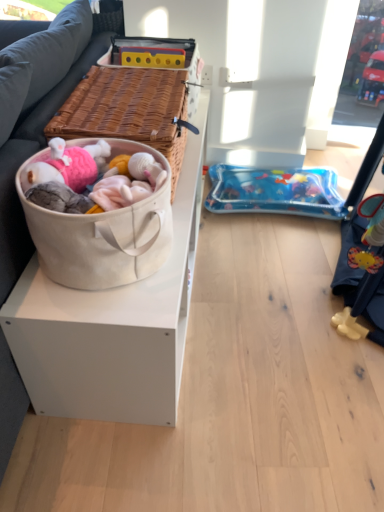
Identify the location of blue inflatable mattress at lower right. Image resolution: width=384 pixels, height=512 pixels. (275, 191).

Describe the element at coordinates (41, 146) in the screenshot. I see `dark gray fabric couch at left` at that location.

Measure the distance between beige canvas basket at left and camera.

A distance of 34.04 inches exists between beige canvas basket at left and camera.

Identify the location of woven brown picnic basket at left. The width and height of the screenshot is (384, 512). (129, 110).

Image resolution: width=384 pixels, height=512 pixels. In order to click on picnic basket above the beige canvas basket at left (from the image's perspective) in this screenshot , I will do `click(129, 110)`.

Considering the relative positions of woven brown picnic basket at left and beige canvas basket at left in the image provided, is woven brown picnic basket at left to the right of beige canvas basket at left from the viewer's perspective?

Yes.

Does woven brown picnic basket at left turn towards beige canvas basket at left?

No, woven brown picnic basket at left is not turned towards beige canvas basket at left.

Which is behind, woven brown picnic basket at left or beige canvas basket at left?

woven brown picnic basket at left is further from the camera.

Is blue inflatable mattress at lower right in front of or behind woven brown picnic basket at left in the image?

Visually, blue inflatable mattress at lower right is located behind woven brown picnic basket at left.

From the image's perspective, is blue inflatable mattress at lower right located above woven brown picnic basket at left?

No, from the image's perspective, blue inflatable mattress at lower right is not on top of woven brown picnic basket at left.

Is blue inflatable mattress at lower right outside of woven brown picnic basket at left?

blue inflatable mattress at lower right lies outside woven brown picnic basket at left's area.

Is point (258, 197) positioned behind point (85, 97)?

Yes, it is behind point (85, 97).

Considering the positions of point (56, 99) and point (54, 245), is point (56, 99) closer or farther from the camera than point (54, 245)?

Point (56, 99) appears to be farther away from the viewer than point (54, 245).

Considering the sizes of dark gray fabric couch at left and beige canvas basket at left in the image, is dark gray fabric couch at left taller or shorter than beige canvas basket at left?

In the image, dark gray fabric couch at left appears to be taller than beige canvas basket at left.

Is dark gray fabric couch at left beside beige canvas basket at left?

dark gray fabric couch at left is not next to beige canvas basket at left, and they're not touching.

Can we say dark gray fabric couch at left lies outside beige canvas basket at left?

Absolutely, dark gray fabric couch at left is external to beige canvas basket at left.

Looking at this image, from the image's perspective, is beige canvas basket at left under woven brown picnic basket at left?

Indeed, from the image's perspective, beige canvas basket at left is shown beneath woven brown picnic basket at left.

Considering the relative positions of beige canvas basket at left and woven brown picnic basket at left in the image provided, is beige canvas basket at left to the left or to the right of woven brown picnic basket at left?

beige canvas basket at left is positioned on woven brown picnic basket at left's left side.

Consider the image. Which object is closer to the camera, beige canvas basket at left or woven brown picnic basket at left?

beige canvas basket at left.

Which of these two, beige canvas basket at left or woven brown picnic basket at left, stands shorter?

Standing shorter between the two is woven brown picnic basket at left.

Would you consider beige canvas basket at left to be distant from dark gray fabric couch at left?

No, beige canvas basket at left is in close proximity to dark gray fabric couch at left.

Would you say beige canvas basket at left is outside dark gray fabric couch at left?

Yes, beige canvas basket at left is located beyond the bounds of dark gray fabric couch at left.

From the image's perspective, is beige canvas basket at left under dark gray fabric couch at left?

Yes, from the image's perspective, beige canvas basket at left is below dark gray fabric couch at left.

Looking at the image, does beige canvas basket at left seem bigger or smaller compared to dark gray fabric couch at left?

beige canvas basket at left is smaller than dark gray fabric couch at left.

Does blue inflatable mattress at lower right turn towards beige canvas basket at left?

No.

Based on their sizes in the image, would you say blue inflatable mattress at lower right is bigger or smaller than beige canvas basket at left?

blue inflatable mattress at lower right is smaller than beige canvas basket at left.

Considering the positions of objects blue inflatable mattress at lower right and beige canvas basket at left in the image provided, who is more to the right, blue inflatable mattress at lower right or beige canvas basket at left?

From the viewer's perspective, blue inflatable mattress at lower right appears more on the right side.

Is blue inflatable mattress at lower right taller or shorter than beige canvas basket at left?

In the image, blue inflatable mattress at lower right appears to be shorter than beige canvas basket at left.

Is dark gray fabric couch at left placed right next to blue inflatable mattress at lower right?

dark gray fabric couch at left is not next to blue inflatable mattress at lower right, and they're not touching.

Which is correct: dark gray fabric couch at left is inside blue inflatable mattress at lower right, or outside of it?

dark gray fabric couch at left is spatially situated outside blue inflatable mattress at lower right.

Could you tell me if dark gray fabric couch at left is facing blue inflatable mattress at lower right?

No, dark gray fabric couch at left is not facing towards blue inflatable mattress at lower right.

Image resolution: width=384 pixels, height=512 pixels. Identify the location of infant bed below the dark gray fabric couch at left (from the image's perspective). (275, 191).

Identify the location of picnic basket above the beige canvas basket at left (from the image's perspective). Image resolution: width=384 pixels, height=512 pixels. (129, 110).

What are the coordinates of `infant bed that is below the woven brown picnic basket at left (from the image's perspective)` in the screenshot? It's located at (275, 191).

Based on the photo, from the image, which object appears to be farther from dark gray fabric couch at left, blue inflatable mattress at lower right or beige canvas basket at left?

blue inflatable mattress at lower right.

From the image, which object appears to be nearer to beige canvas basket at left, woven brown picnic basket at left or blue inflatable mattress at lower right?

woven brown picnic basket at left is closer to beige canvas basket at left.

From the picture: From the image, which object appears to be nearer to blue inflatable mattress at lower right, beige canvas basket at left or woven brown picnic basket at left?

Among the two, woven brown picnic basket at left is located nearer to blue inflatable mattress at lower right.

Looking at the image, which one is located closer to beige canvas basket at left, dark gray fabric couch at left or blue inflatable mattress at lower right?

dark gray fabric couch at left is positioned closer to the anchor beige canvas basket at left.

Estimate the real-world distances between objects in this image. Which object is further from dark gray fabric couch at left, blue inflatable mattress at lower right or woven brown picnic basket at left?

blue inflatable mattress at lower right is further to dark gray fabric couch at left.

Looking at the image, which one is located closer to blue inflatable mattress at lower right, woven brown picnic basket at left or dark gray fabric couch at left?

Based on the image, woven brown picnic basket at left appears to be nearer to blue inflatable mattress at lower right.

When comparing their distances from woven brown picnic basket at left, does blue inflatable mattress at lower right or beige canvas basket at left seem closer?

Based on the image, beige canvas basket at left appears to be nearer to woven brown picnic basket at left.

Consider the image. When comparing their distances from woven brown picnic basket at left, does dark gray fabric couch at left or beige canvas basket at left seem closer?

dark gray fabric couch at left is positioned closer to the anchor woven brown picnic basket at left.

Where is `picnic basket located between dark gray fabric couch at left and blue inflatable mattress at lower right in the depth direction`? The width and height of the screenshot is (384, 512). picnic basket located between dark gray fabric couch at left and blue inflatable mattress at lower right in the depth direction is located at coordinates (129, 110).

Where is `gift basket between dark gray fabric couch at left and woven brown picnic basket at left`? Image resolution: width=384 pixels, height=512 pixels. gift basket between dark gray fabric couch at left and woven brown picnic basket at left is located at coordinates (102, 234).

Where is `gift basket between dark gray fabric couch at left and blue inflatable mattress at lower right along the z-axis`? The height and width of the screenshot is (512, 384). gift basket between dark gray fabric couch at left and blue inflatable mattress at lower right along the z-axis is located at coordinates (102, 234).

Locate an element on the screen. The width and height of the screenshot is (384, 512). picnic basket between beige canvas basket at left and blue inflatable mattress at lower right along the z-axis is located at coordinates (129, 110).